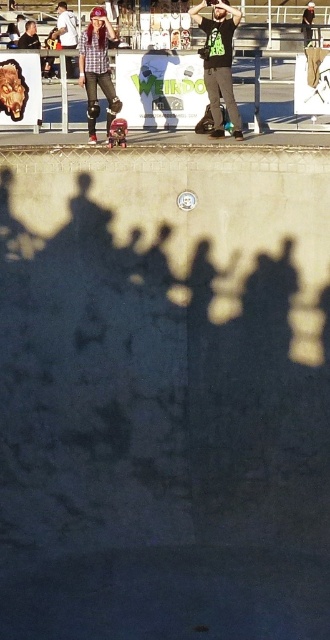
Question: Where is green matte shirt at upper center located in relation to matte plaid shirt at center in the image?

Choices:
 (A) above
 (B) below

Answer: (B)

Question: Considering the real-world distances, which object is closest to the matte plaid shirt at center?

Choices:
 (A) green matte shirt at upper center
 (B) metallic pink skateboard at center
 (C) matte black shirt at upper left

Answer: (B)

Question: Which of the following is the closest to the observer?

Choices:
 (A) matte plaid shirt at center
 (B) green matte shirt at upper center

Answer: (B)

Question: Which of these objects is positioned farthest from the matte plaid shirt at center?

Choices:
 (A) matte black shirt at upper left
 (B) green matte shirt at upper center

Answer: (A)

Question: Can you confirm if green matte shirt at upper center is thinner than matte plaid shirt at center?

Choices:
 (A) yes
 (B) no

Answer: (B)

Question: Is green matte shirt at upper center thinner than matte plaid shirt at center?

Choices:
 (A) yes
 (B) no

Answer: (B)